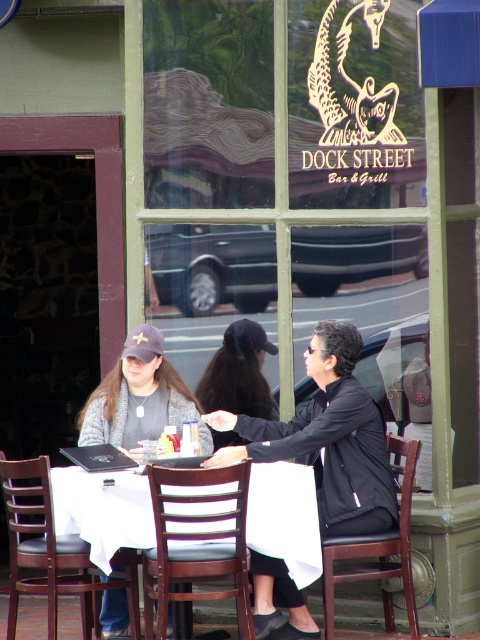
Does white cloth at lower center have a larger size compared to matte gray cap at left?

No.

Which of these two, white cloth at lower center or matte gray cap at left, stands taller?

matte gray cap at left is taller.

This screenshot has width=480, height=640. Find the location of `white cloth at lower center`. white cloth at lower center is located at coordinates (103, 509).

Can you confirm if matte black jacket at center is wider than matte gray cap at left?

Yes.

Consider the image. Is matte black jacket at center bigger than matte gray cap at left?

Correct, matte black jacket at center is larger in size than matte gray cap at left.

Who is more distant from viewer, (296, 426) or (168, 406)?

Positioned behind is point (168, 406).

Locate an element on the screen. matte black jacket at center is located at coordinates (326, 438).

Which of these two, white cloth at lower center or dark brown hair at center, stands shorter?

Standing shorter between the two is white cloth at lower center.

Does white cloth at lower center have a larger size compared to dark brown hair at center?

Yes.

Is point (59, 468) positioned in front of point (227, 374)?

Yes.

Find the location of `white cloth at lower center`. white cloth at lower center is located at coordinates (103, 509).